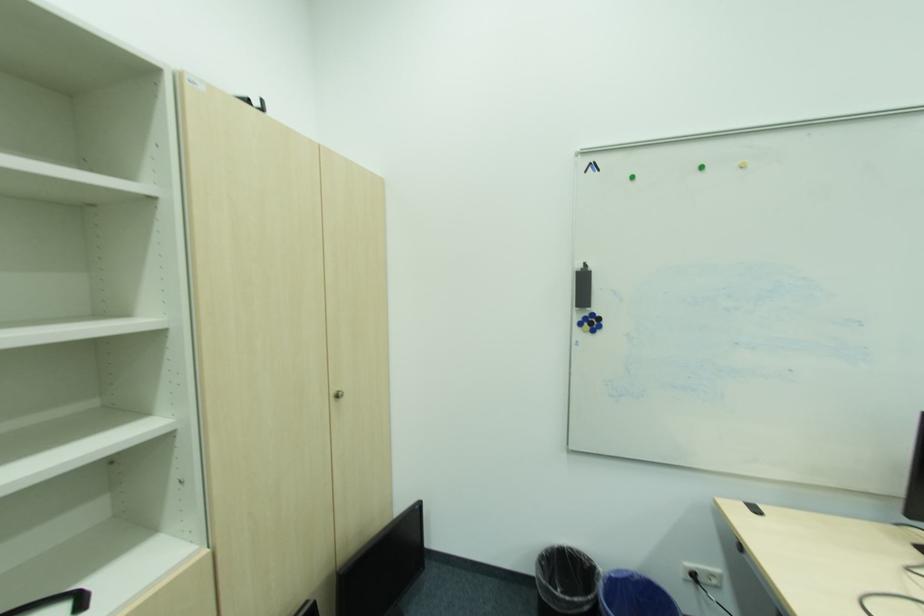
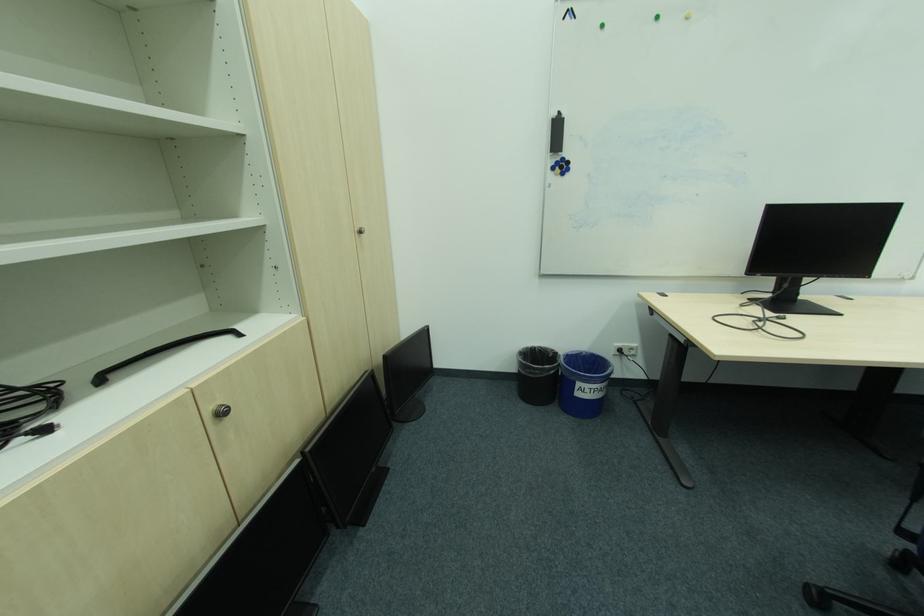
Find the pixel in the second image that matches pixel 579 549 in the first image.

(546, 347)